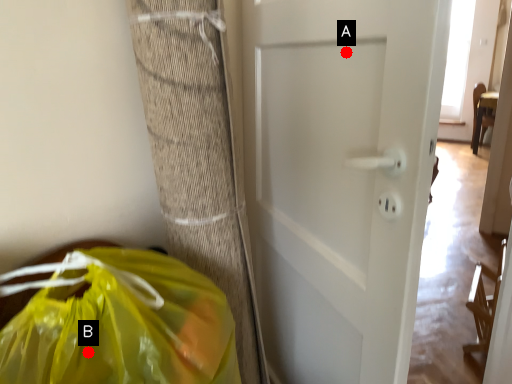
Question: Two points are circled on the image, labeled by A and B beside each circle. Which point is closer to the camera taking this photo?

Choices:
 (A) A is closer
 (B) B is closer

Answer: (B)